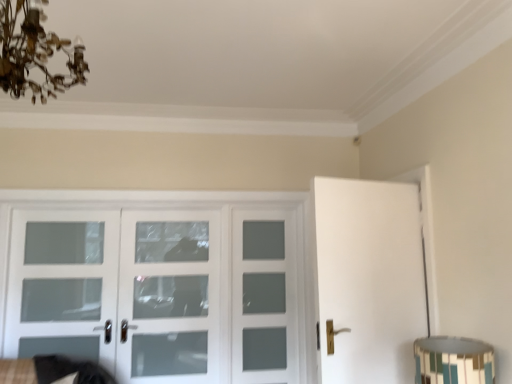
Question: From the image's perspective, is clear glass door at left, which is counted as the first screen door, starting from the left, above white frosted glass door at center, arranged as the second screen door when viewed from the right?

Choices:
 (A) yes
 (B) no

Answer: (A)

Question: Is clear glass door at left, which is the third screen door from right to left, to the left of white frosted glass door at center, arranged as the second screen door when viewed from the right, from the viewer's perspective?

Choices:
 (A) no
 (B) yes

Answer: (B)

Question: Is clear glass door at left, which is counted as the first screen door, starting from the left, far from white frosted glass door at center, arranged as the 2th screen door when viewed from the left?

Choices:
 (A) no
 (B) yes

Answer: (A)

Question: From the image's perspective, does clear glass door at left, which is the third screen door from right to left, appear lower than white frosted glass door at center, arranged as the 2th screen door when viewed from the left?

Choices:
 (A) no
 (B) yes

Answer: (A)

Question: Does clear glass door at left, which is the third screen door from right to left, have a smaller size compared to white frosted glass door at center, arranged as the second screen door when viewed from the right?

Choices:
 (A) yes
 (B) no

Answer: (B)

Question: From the image's perspective, is multicolored mosaic lampshade at lower right located above or below white frosted glass door at center, the 1th screen door in the right-to-left sequence?

Choices:
 (A) above
 (B) below

Answer: (A)

Question: Is multicolored mosaic lampshade at lower right taller or shorter than white frosted glass door at center, the 1th screen door in the right-to-left sequence?

Choices:
 (A) short
 (B) tall

Answer: (A)

Question: Would you say multicolored mosaic lampshade at lower right is inside or outside white frosted glass door at center, the 1th screen door in the right-to-left sequence?

Choices:
 (A) outside
 (B) inside

Answer: (A)

Question: In terms of size, does multicolored mosaic lampshade at lower right appear bigger or smaller than white frosted glass door at center, the 1th screen door in the right-to-left sequence?

Choices:
 (A) small
 (B) big

Answer: (A)

Question: Is white frosted glass door at center, arranged as the 2th screen door when viewed from the left, taller or shorter than white frosted glass door at center, the 1th screen door in the right-to-left sequence?

Choices:
 (A) tall
 (B) short

Answer: (B)

Question: Based on their positions, is white frosted glass door at center, arranged as the second screen door when viewed from the right, located to the left or right of white frosted glass door at center, the 1th screen door in the right-to-left sequence?

Choices:
 (A) left
 (B) right

Answer: (A)

Question: Is point (126, 375) closer or farther from the camera than point (250, 228)?

Choices:
 (A) farther
 (B) closer

Answer: (B)

Question: From the image's perspective, is white frosted glass door at center, arranged as the second screen door when viewed from the right, above or below white frosted glass door at center, the 1th screen door in the right-to-left sequence?

Choices:
 (A) above
 (B) below

Answer: (A)

Question: From the image's perspective, is clear glass door at left, which is the third screen door from right to left, above or below white glass door at center?

Choices:
 (A) above
 (B) below

Answer: (A)

Question: Would you say clear glass door at left, which is the third screen door from right to left, is inside or outside white glass door at center?

Choices:
 (A) outside
 (B) inside

Answer: (B)